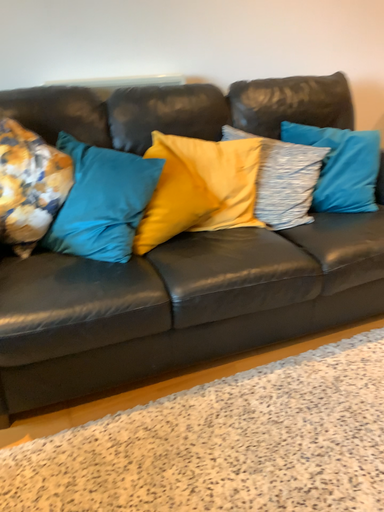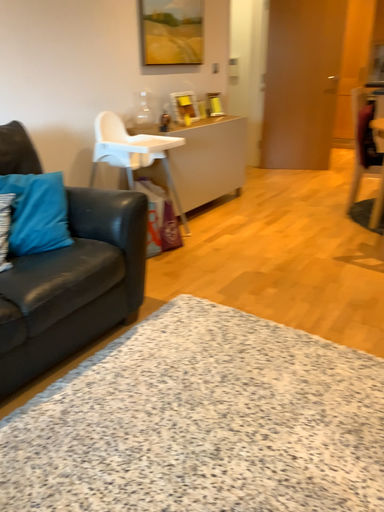
Question: How did the camera likely rotate when shooting the video?

Choices:
 (A) rotated upward
 (B) rotated downward

Answer: (A)